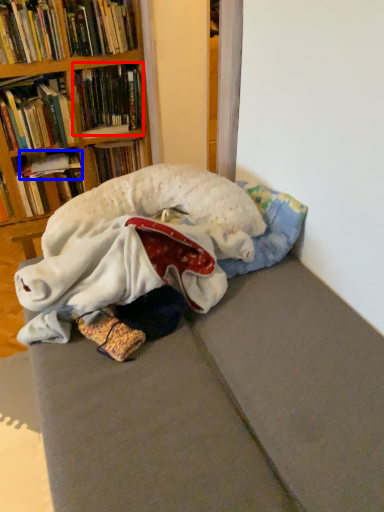
Question: Which object is further to the camera taking this photo, book (highlighted by a red box) or book (highlighted by a blue box)?

Choices:
 (A) book
 (B) book

Answer: (B)